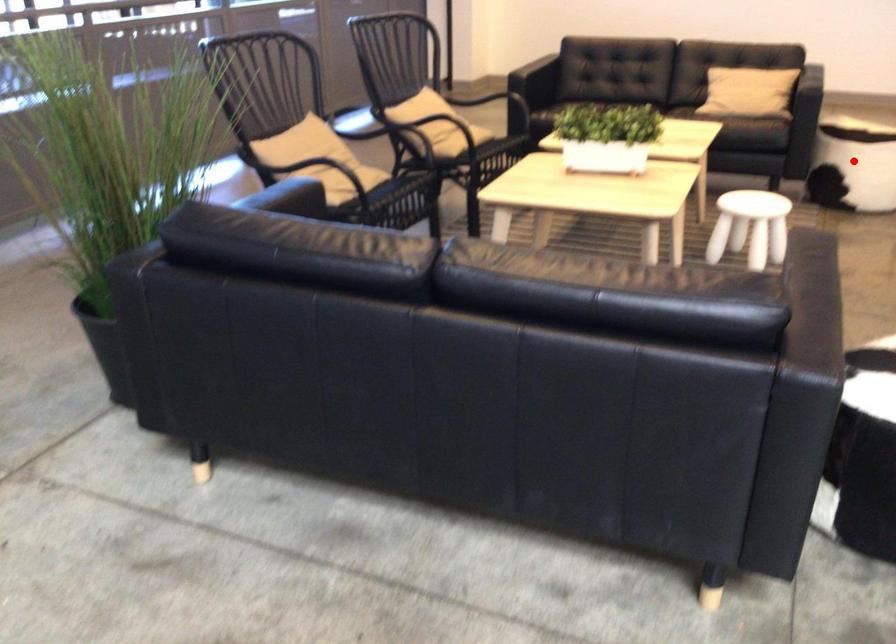
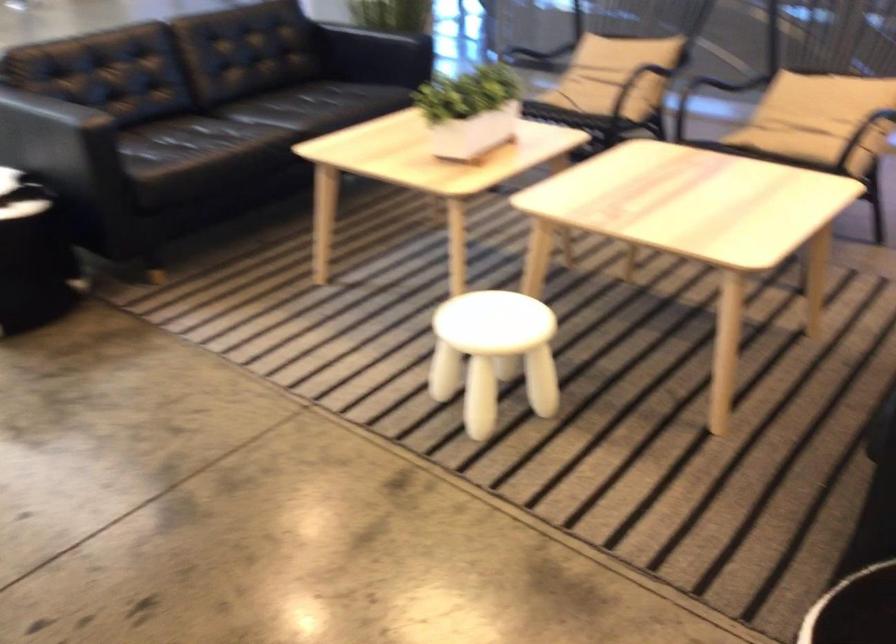
Question: I am providing you with two images of the same scene from different viewpoints. A red point is marked on the first image. Can you still see the location of the red point in image 2?

Choices:
 (A) Yes
 (B) No

Answer: (B)